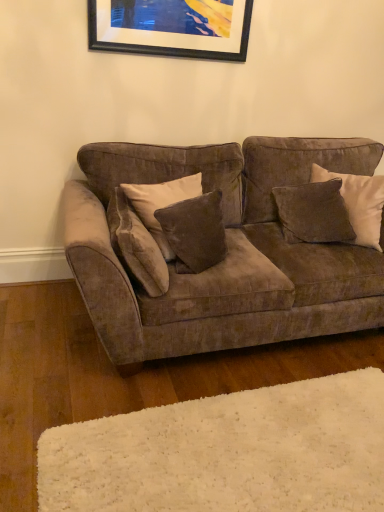
Question: Considering the relative sizes of black matte picture frame at upper center and velvet brown pillow at center, the first pillow in the left-to-right sequence, in the image provided, is black matte picture frame at upper center thinner than velvet brown pillow at center, the first pillow in the left-to-right sequence,?

Choices:
 (A) yes
 (B) no

Answer: (A)

Question: Can you confirm if black matte picture frame at upper center is positioned to the right of velvet brown pillow at center, the 4th pillow in the right-to-left sequence?

Choices:
 (A) no
 (B) yes

Answer: (B)

Question: Does black matte picture frame at upper center contain velvet brown pillow at center, the 4th pillow in the right-to-left sequence?

Choices:
 (A) no
 (B) yes

Answer: (A)

Question: Considering the relative sizes of black matte picture frame at upper center and velvet brown pillow at center, the 4th pillow in the right-to-left sequence, in the image provided, is black matte picture frame at upper center shorter than velvet brown pillow at center, the 4th pillow in the right-to-left sequence,?

Choices:
 (A) no
 (B) yes

Answer: (B)

Question: Does black matte picture frame at upper center have a smaller size compared to velvet brown pillow at center, the first pillow in the left-to-right sequence?

Choices:
 (A) no
 (B) yes

Answer: (B)

Question: Is velvet brown pillow at upper right, which appears as the 1th pillow when viewed from the right, in front of or behind white shag rug at lower center in the image?

Choices:
 (A) behind
 (B) front

Answer: (A)

Question: In terms of height, does velvet brown pillow at upper right, the 4th pillow from the left, look taller or shorter compared to white shag rug at lower center?

Choices:
 (A) short
 (B) tall

Answer: (B)

Question: From a real-world perspective, relative to white shag rug at lower center, is velvet brown pillow at upper right, the 4th pillow from the left, vertically above or below?

Choices:
 (A) above
 (B) below

Answer: (A)

Question: From the image's perspective, is velvet brown pillow at upper right, which appears as the 1th pillow when viewed from the right, positioned above or below white shag rug at lower center?

Choices:
 (A) above
 (B) below

Answer: (A)

Question: Is white shag rug at lower center inside the boundaries of velvet brown pillow at right, the second pillow viewed from the right, or outside?

Choices:
 (A) outside
 (B) inside

Answer: (A)

Question: In terms of width, does white shag rug at lower center look wider or thinner when compared to velvet brown pillow at right, which is the 3th pillow in left-to-right order?

Choices:
 (A) wide
 (B) thin

Answer: (A)

Question: Relative to velvet brown pillow at right, which is the 3th pillow in left-to-right order, is white shag rug at lower center in front or behind?

Choices:
 (A) behind
 (B) front

Answer: (B)

Question: Is white shag rug at lower center bigger or smaller than velvet brown pillow at right, which is the 3th pillow in left-to-right order?

Choices:
 (A) small
 (B) big

Answer: (A)

Question: In the image, is velvet brown pillow at right, which is the 3th pillow in left-to-right order, on the left side or the right side of velvet brown couch at center?

Choices:
 (A) left
 (B) right

Answer: (B)

Question: From a real-world perspective, is velvet brown pillow at right, which is the 3th pillow in left-to-right order, physically located above or below velvet brown couch at center?

Choices:
 (A) above
 (B) below

Answer: (A)